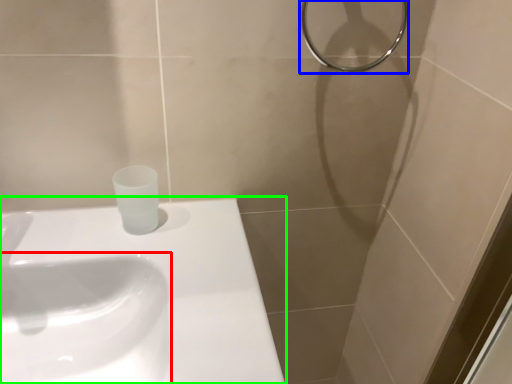
Question: Based on their relative distances, which object is nearer to sink (highlighted by a red box)? Choose from shower (highlighted by a blue box) and sink (highlighted by a green box).

Choices:
 (A) shower
 (B) sink

Answer: (B)